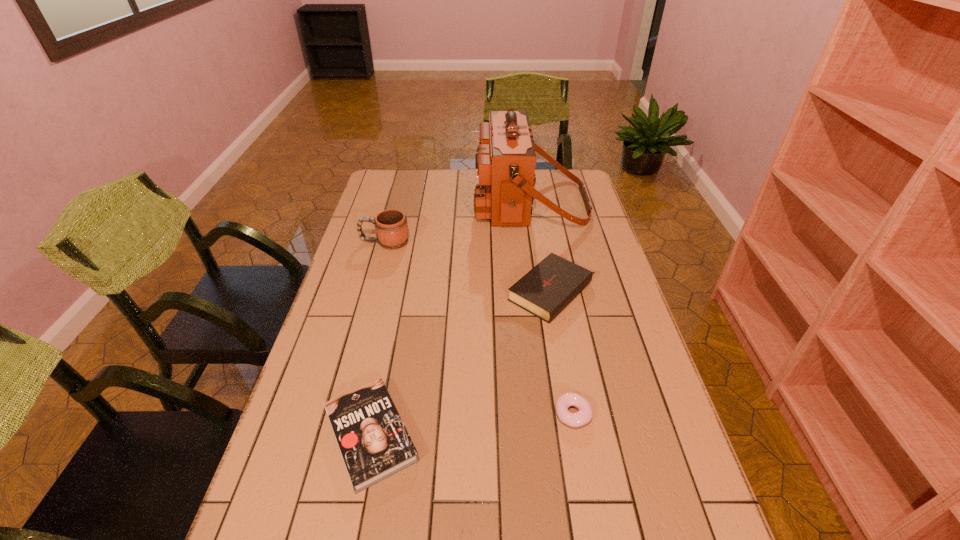
This screenshot has width=960, height=540. In the image, there is a desktop. What are the coordinates of `vacant area at the right edge` in the screenshot? It's located at (596, 271).

In order to click on vacant region at the far left corner in this screenshot , I will do point(373,185).

Identify the location of vacant point located between the doughnut and the book. (472, 424).

Locate an element on the screen. vacant space that is in between the doughnut and the mug is located at coordinates (479, 328).

I want to click on free spot between the fourth shortest object and the book, so click(378, 339).

You are a GUI agent. You are given a task and a screenshot of the screen. Output one action in this format:
    pyautogui.click(x=<x>, y=<y>)
    Task: Click on the vacant point located between the mug and the book
    The image size is (960, 540).
    Given the screenshot: What is the action you would take?
    pyautogui.click(x=378, y=339)

At what (x,y) coordinates should I click in order to perform the action: click on free point between the doughnut and the third tallest object. Please return your answer as a coordinate pair (x, y). The width and height of the screenshot is (960, 540). Looking at the image, I should click on (564, 353).

Where is `vacant region between the Bible and the fourth shortest object`? This screenshot has height=540, width=960. vacant region between the Bible and the fourth shortest object is located at coordinates (469, 267).

Identify the location of empty location between the book and the doughnut. (472, 424).

Locate an element on the screen. The width and height of the screenshot is (960, 540). vacant space that's between the book and the tallest object is located at coordinates (450, 319).